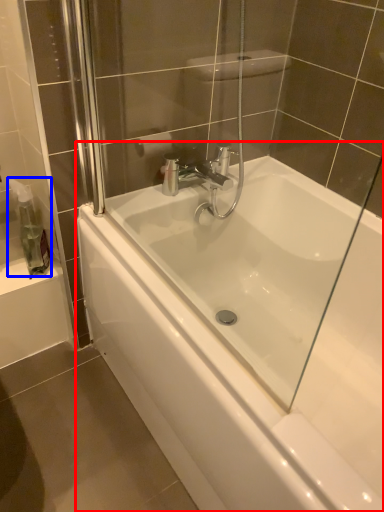
Question: Which point is further to the camera, bathtub (highlighted by a red box) or soap dispenser (highlighted by a blue box)?

Choices:
 (A) bathtub
 (B) soap dispenser

Answer: (B)